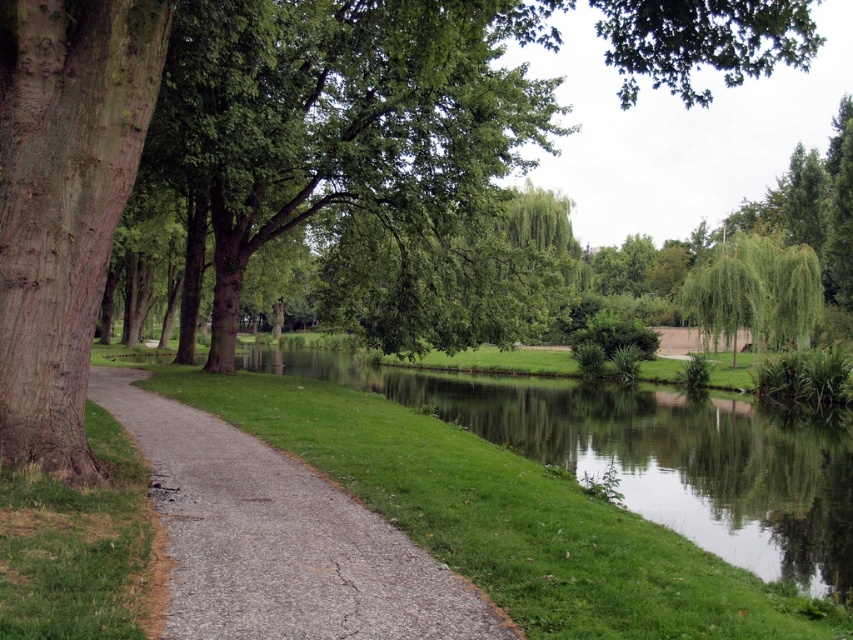
Question: Which of the following is the farthest from the observer?

Choices:
 (A) (346, 536)
 (B) (189, 326)
 (C) (79, 124)

Answer: (B)

Question: Which of these objects is positioned farthest from the gray asphalt path at center?

Choices:
 (A) green leafy tree at upper left
 (B) green leafy tree at left

Answer: (B)

Question: Which of the following is the closest to the observer?

Choices:
 (A) green leafy tree at upper left
 (B) green leafy tree at left
 (C) smooth brown bark at left
 (D) gray asphalt path at center

Answer: (D)

Question: Does green leafy tree at left have a smaller size compared to smooth brown bark at left?

Choices:
 (A) no
 (B) yes

Answer: (A)

Question: Is green leafy tree at left wider than smooth brown bark at left?

Choices:
 (A) no
 (B) yes

Answer: (B)

Question: Is green leafy tree at left further to camera compared to smooth brown bark at left?

Choices:
 (A) no
 (B) yes

Answer: (B)